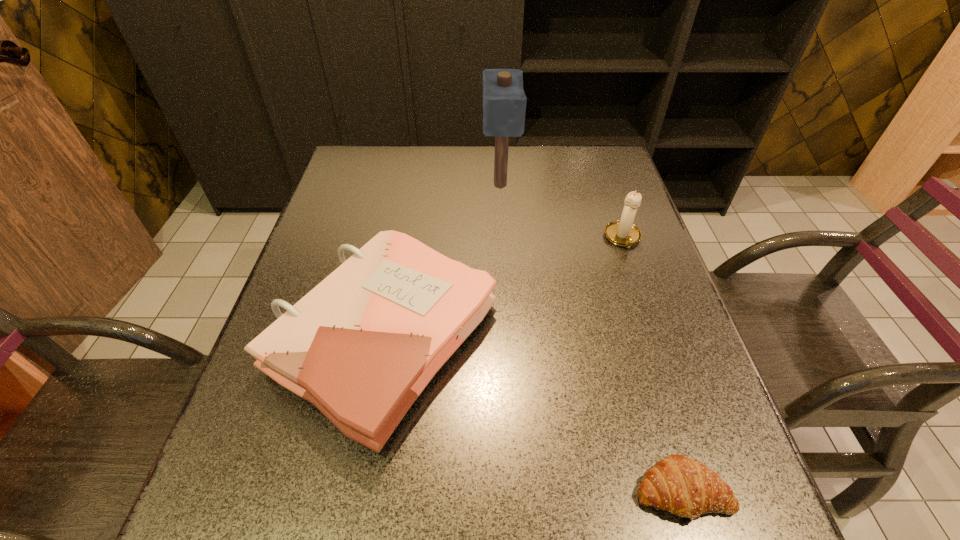
Where is `empty space between the crescent roll and the second nearest object`? The width and height of the screenshot is (960, 540). empty space between the crescent roll and the second nearest object is located at coordinates (534, 415).

Identify the location of blank region between the phonebook and the shortest object. This screenshot has width=960, height=540. (534, 415).

Locate an element on the screen. vacant area that lies between the nearest object and the candle holder is located at coordinates (653, 364).

Locate an element on the screen. The image size is (960, 540). vacant area between the shortest object and the second tallest object is located at coordinates (653, 364).

Identify the location of object that is the second nearest to the candle holder. Image resolution: width=960 pixels, height=540 pixels. (361, 346).

Locate an element on the screen. This screenshot has height=540, width=960. the third closest object to the third farthest object is located at coordinates (623, 233).